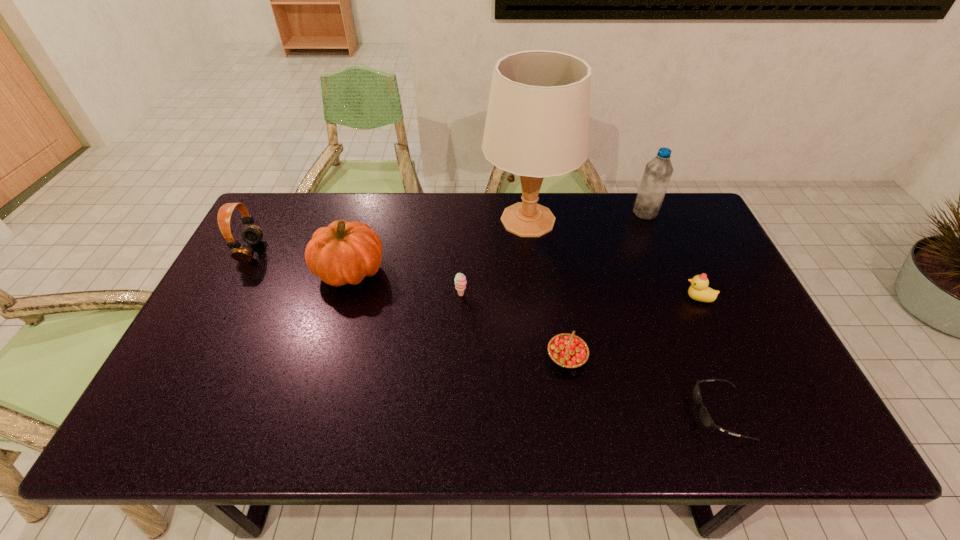
You are a GUI agent. You are given a task and a screenshot of the screen. Output one action in this format:
    pyautogui.click(x=<x>, y=<y>)
    Task: Click on the vacant space located on the front of the seventh shortest object
    The image size is (960, 540).
    Given the screenshot: What is the action you would take?
    658,242

Find the location of a particular element. Image resolution: width=960 pixels, height=540 pixels. vacant point located 0.140m on the right of the pumpkin is located at coordinates (433, 271).

Where is `free space located on the ear cups of the headset`? The image size is (960, 540). free space located on the ear cups of the headset is located at coordinates click(x=377, y=251).

You are a GUI agent. You are given a task and a screenshot of the screen. Output one action in this format:
    pyautogui.click(x=<x>, y=<y>)
    Task: Click on the free region located 0.100m on the left of the sherbert
    The height and width of the screenshot is (540, 960).
    Given the screenshot: What is the action you would take?
    pyautogui.click(x=420, y=295)

Where is `free space located 0.190m on the front-facing side of the duckling`? This screenshot has height=540, width=960. free space located 0.190m on the front-facing side of the duckling is located at coordinates (614, 298).

Locate an element on the screen. This screenshot has height=540, width=960. blank space located on the front-facing side of the duckling is located at coordinates (542, 298).

The image size is (960, 540). Find the location of `vacant space situated on the front-facing side of the duckling`. vacant space situated on the front-facing side of the duckling is located at coordinates (604, 298).

The height and width of the screenshot is (540, 960). I want to click on vacant region located on the left of the strawberry, so click(x=445, y=357).

Where is `vacant space located 0.140m on the front-facing side of the nearest object`? Image resolution: width=960 pixels, height=540 pixels. vacant space located 0.140m on the front-facing side of the nearest object is located at coordinates (632, 413).

I want to click on vacant point located 0.330m on the front-facing side of the nearest object, so click(547, 413).